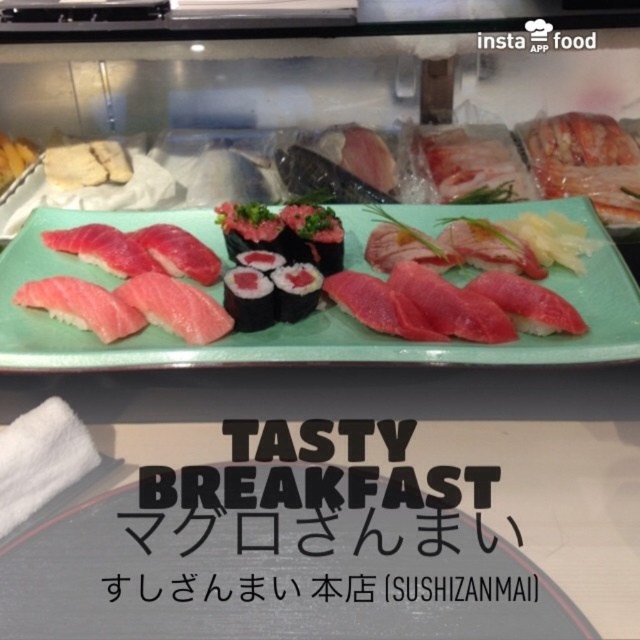
Question: Which object is the closest to the smokey pink rice at center?

Choices:
 (A) black rice ball at center
 (B) green ceramic plate at center

Answer: (A)

Question: Which point appears farthest from the camera in this image?

Choices:
 (A) (248, 307)
 (B) (580, 276)

Answer: (B)

Question: Can you confirm if black paper sign at center is bigger than smokey pink rice at center?

Choices:
 (A) no
 (B) yes

Answer: (B)

Question: Which point is closer to the camera?

Choices:
 (A) smokey pink rice at center
 (B) black rice ball at center
 (C) green ceramic plate at center
 (D) black paper sign at center

Answer: (D)

Question: Where is green ceramic plate at center located in relation to smokey pink rice at center in the image?

Choices:
 (A) below
 (B) above

Answer: (B)

Question: Does black paper sign at center appear under green ceramic plate at center?

Choices:
 (A) yes
 (B) no

Answer: (A)